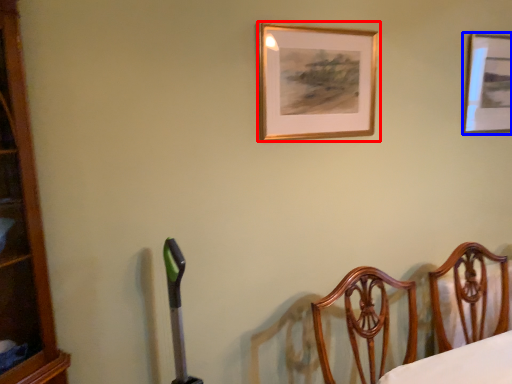
Question: Which of the following is the farthest to the observer, picture frame (highlighted by a red box) or picture frame (highlighted by a blue box)?

Choices:
 (A) picture frame
 (B) picture frame

Answer: (B)